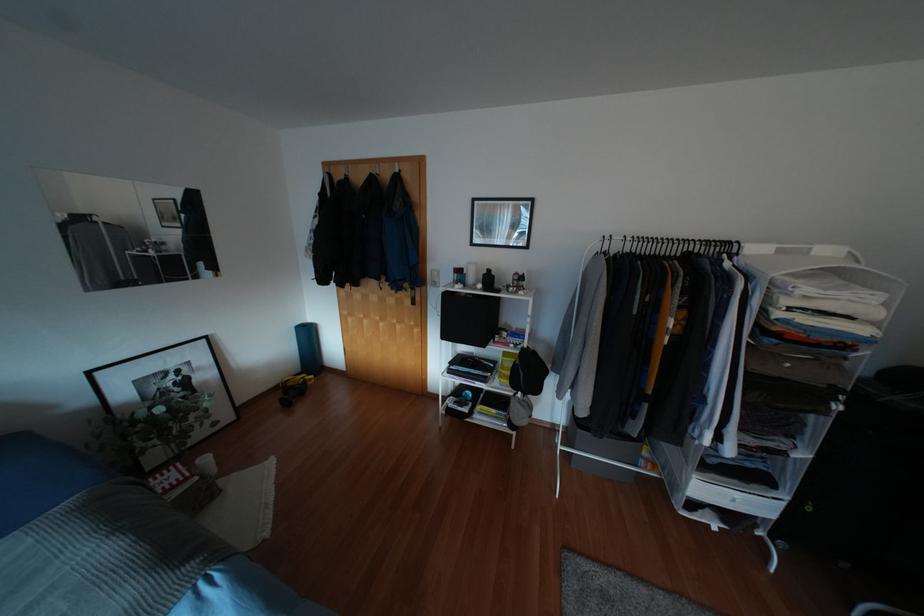
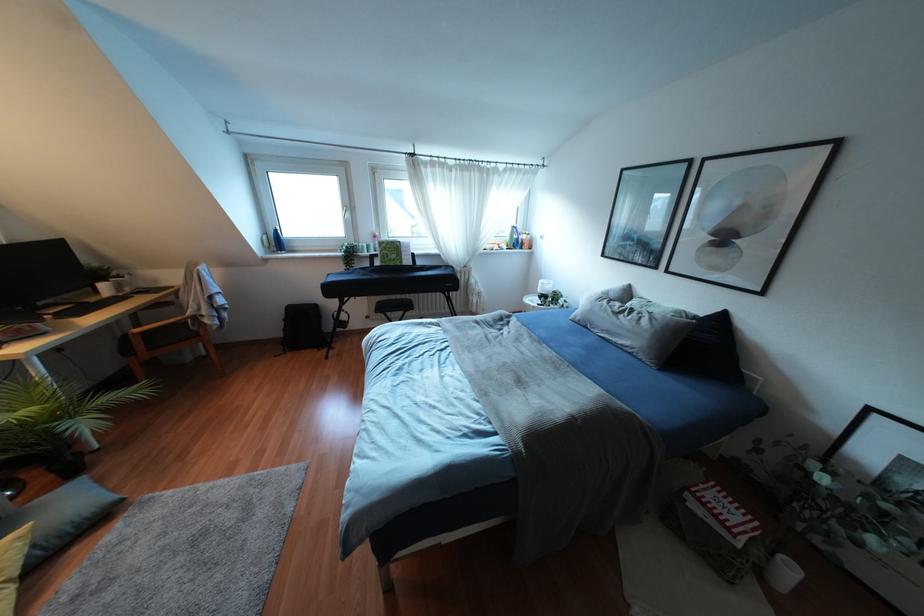
The point at (205, 459) is marked in the first image. Where is the corresponding point in the second image?

(791, 570)